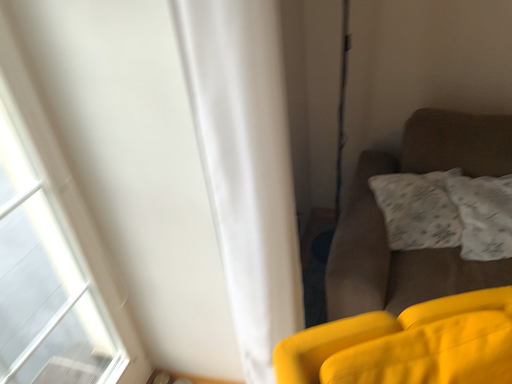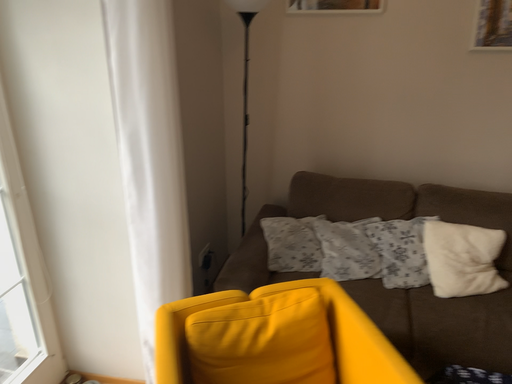
Question: How did the camera likely rotate when shooting the video?

Choices:
 (A) rotated left
 (B) rotated right

Answer: (B)